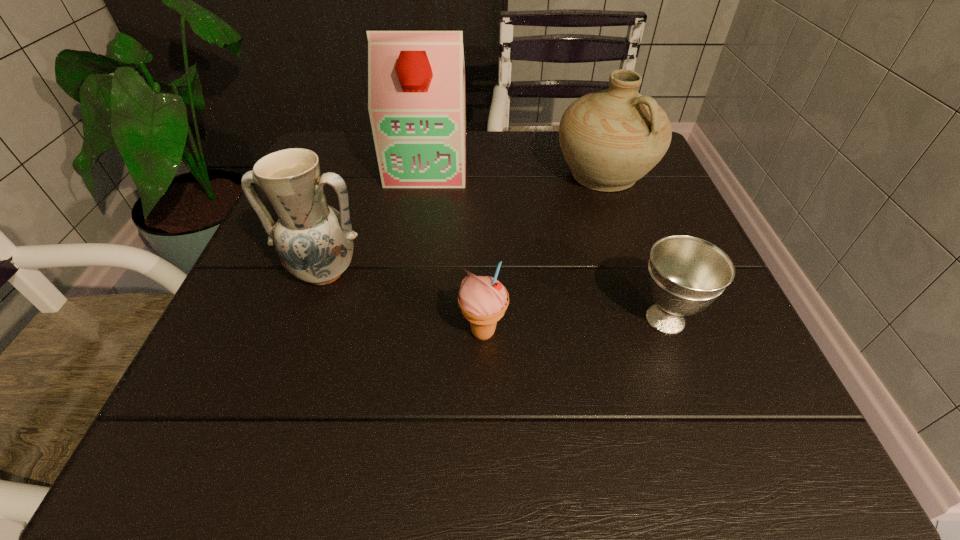
Locate an element on the screen. This screenshot has height=540, width=960. soya milk that is positioned at the far edge is located at coordinates (416, 77).

Where is `pottery that is positioned at the far edge`? pottery that is positioned at the far edge is located at coordinates (610, 139).

I want to click on object located at the left edge, so click(x=314, y=241).

Find the location of a particular element. The height and width of the screenshot is (540, 960). pottery located at the right edge is located at coordinates (610, 139).

You are a GUI agent. You are given a task and a screenshot of the screen. Output one action in this format:
    pyautogui.click(x=<x>, y=<y>)
    Task: Click on the chalice present at the right edge
    
    Given the screenshot: What is the action you would take?
    pyautogui.click(x=686, y=274)

You are a GUI agent. You are given a task and a screenshot of the screen. Output one action in this format:
    pyautogui.click(x=<x>, y=<y>)
    Task: Click on the object positioned at the far right corner
    The height and width of the screenshot is (540, 960).
    Given the screenshot: What is the action you would take?
    pyautogui.click(x=610, y=139)

Locate an element on the screen. Image resolution: width=960 pixels, height=540 pixels. free space at the far edge of the desktop is located at coordinates (476, 150).

In the image, there is a desktop. Where is `vacant space at the near edge`? vacant space at the near edge is located at coordinates (607, 451).

Find the location of a particular element. This screenshot has width=960, height=540. vacant region at the left edge of the desktop is located at coordinates (245, 367).

Where is `vacant space at the right edge of the desktop`? This screenshot has height=540, width=960. vacant space at the right edge of the desktop is located at coordinates (747, 358).